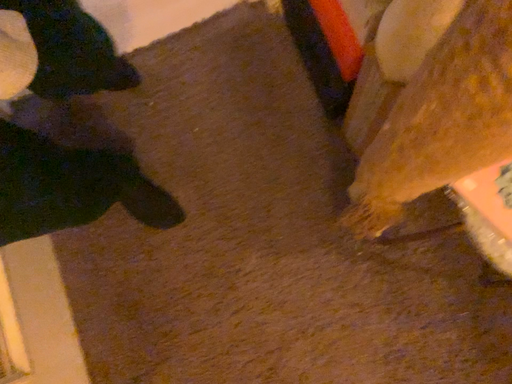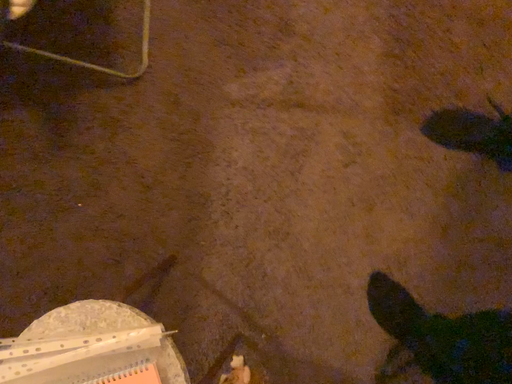
Question: How did the camera likely rotate when shooting the video?

Choices:
 (A) rotated upward
 (B) rotated downward

Answer: (A)